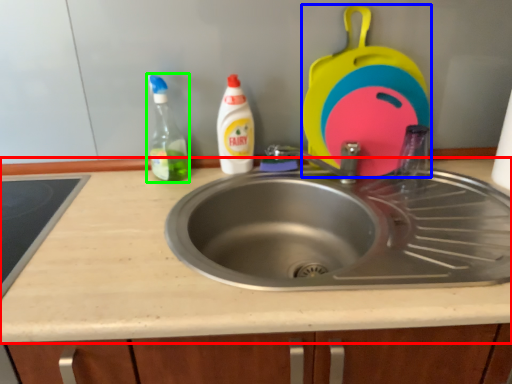
Question: Which is nearer to the countertop (highlighted by a red box)? appliance (highlighted by a blue box) or cleaning product (highlighted by a green box).

Choices:
 (A) appliance
 (B) cleaning product

Answer: (B)